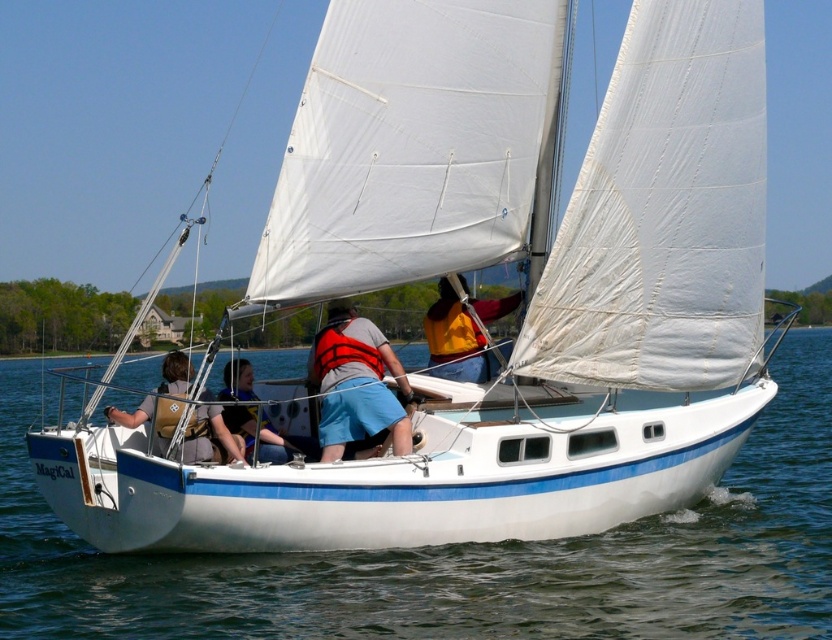
Is point (766, 548) less distant than point (340, 435)?

No, it is not.

Between blue water at center and orange life vest at center, which one has more height?

With more height is blue water at center.

Between point (660, 621) and point (320, 454), which one is positioned in front?

Point (660, 621) is in front.

Locate an element on the screen. This screenshot has height=640, width=832. blue water at center is located at coordinates (464, 556).

Does orange life vest at center have a lesser width compared to yellow life vest at center?

Yes, orange life vest at center is thinner than yellow life vest at center.

Is orange life vest at center closer to camera compared to yellow life vest at center?

No, orange life vest at center is further to the viewer.

What do you see at coordinates (355, 384) in the screenshot?
I see `orange life vest at center` at bounding box center [355, 384].

Where is `orange life vest at center`? The image size is (832, 640). orange life vest at center is located at coordinates (355, 384).

Is blue water at center bigger than yellow life vest at center?

Indeed, blue water at center has a larger size compared to yellow life vest at center.

Is blue water at center above yellow life vest at center?

Actually, blue water at center is below yellow life vest at center.

Who is more distant from viewer, (68, 580) or (259, 422)?

Positioned behind is point (68, 580).

Where is `blue water at center`? Image resolution: width=832 pixels, height=640 pixels. blue water at center is located at coordinates (464, 556).